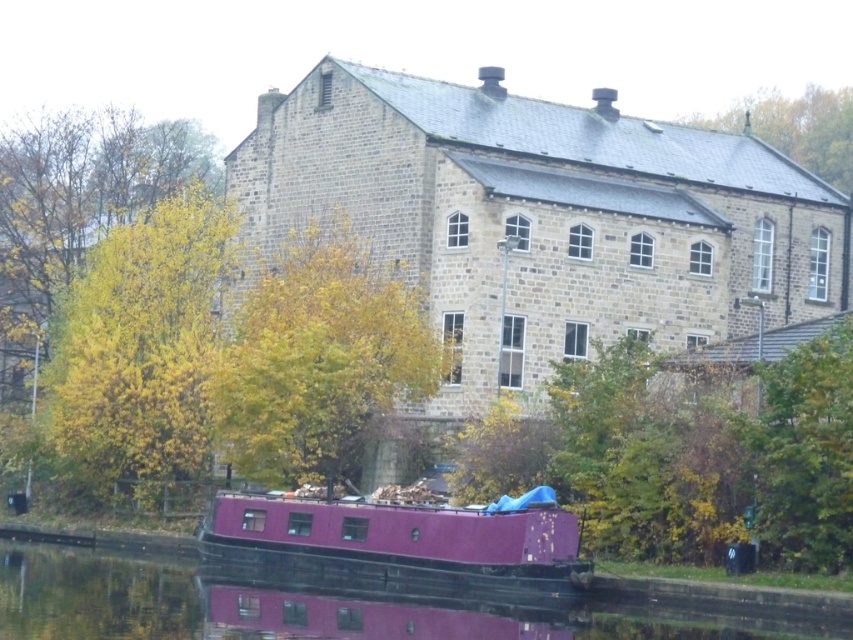
Question: Which of the following is the farthest from the observer?

Choices:
 (A) purple glossy boat at lower center
 (B) yellow leafy tree at left

Answer: (B)

Question: Is yellow leafy tree at left positioned behind purple glossy boat at lower center?

Choices:
 (A) no
 (B) yes

Answer: (B)

Question: Considering the relative positions of yellow leafy tree at left and purple glossy boat at lower center in the image provided, where is yellow leafy tree at left located with respect to purple glossy boat at lower center?

Choices:
 (A) above
 (B) below

Answer: (A)

Question: Which object is positioned closest to the yellow leafy tree at center?

Choices:
 (A) purple glossy boat at lower center
 (B) yellow leafy tree at left
 (C) green leafy tree at upper right

Answer: (B)

Question: Is purple matte barge at lower center wider than green leafy tree at upper right?

Choices:
 (A) no
 (B) yes

Answer: (A)

Question: Estimate the real-world distances between objects in this image. Which object is closer to the purple matte barge at lower center?

Choices:
 (A) purple glossy boat at lower center
 (B) yellow leafy tree at center
 (C) green leafy tree at upper right

Answer: (A)